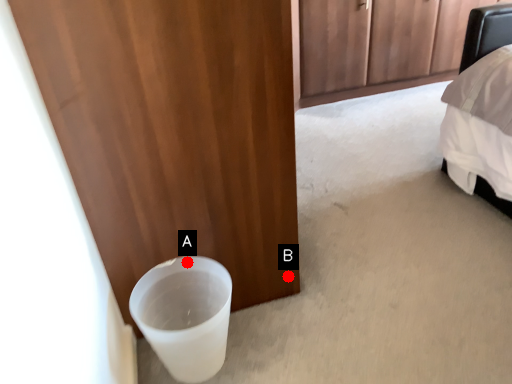
Question: Two points are circled on the image, labeled by A and B beside each circle. Among these points, which one is nearest to the camera?

Choices:
 (A) A is closer
 (B) B is closer

Answer: (A)